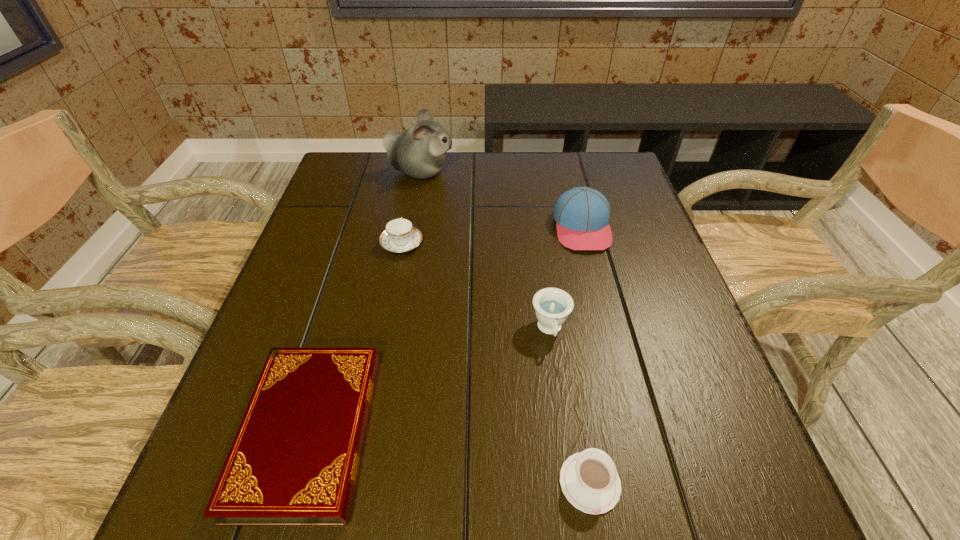
What are the coordinates of `the farthest object` in the screenshot? It's located at (420, 152).

Where is `hamster`? The height and width of the screenshot is (540, 960). hamster is located at coordinates (420, 152).

Identify the location of baseball cap. This screenshot has height=540, width=960. (582, 214).

The height and width of the screenshot is (540, 960). What are the coordinates of `the third nearest object` in the screenshot? It's located at (552, 306).

Locate an element on the screen. the second nearest teacup is located at coordinates (552, 306).

Identify the location of the farthest teacup. (400, 235).

Find the location of a particular element. the nearest teacup is located at coordinates (589, 480).

The image size is (960, 540). I want to click on hardback book, so point(294,461).

Where is `vacant space located on the face of the tallest object`? This screenshot has height=540, width=960. vacant space located on the face of the tallest object is located at coordinates click(x=494, y=172).

You are a GUI agent. You are given a task and a screenshot of the screen. Output one action in this format:
    pyautogui.click(x=<x>, y=<y>)
    Task: Click on the vacant space located 0.180m on the front-facing side of the second tallest object
    
    Given the screenshot: What is the action you would take?
    604,312